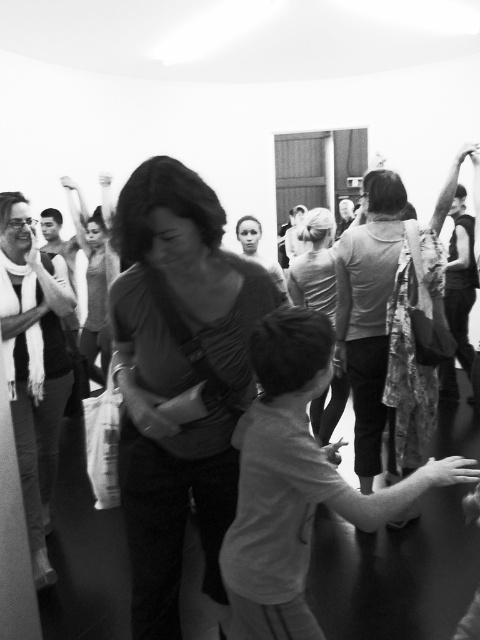
Between white matte shirt at center and smooth gray sweater at center, which one has more height?

white matte shirt at center is taller.

Does white matte shirt at center have a lesser height compared to smooth gray sweater at center?

No, white matte shirt at center is not shorter than smooth gray sweater at center.

The width and height of the screenshot is (480, 640). Find the location of `white matte shirt at center`. white matte shirt at center is located at coordinates 297,481.

This screenshot has height=640, width=480. I want to click on white matte shirt at center, so click(297, 481).

Does matte gray shirt at center have a smaller size compared to matte black shirt at center?

No.

Measure the distance between point [128,324] and camera.

The distance of point [128,324] from camera is 1.50 meters.

The image size is (480, 640). I want to click on matte gray shirt at center, so click(179, 378).

Identify the location of matte gray shirt at center. (179, 378).

Between point (31, 451) and point (332, 387), which one is positioned behind?

The point (332, 387) is behind.

Does matte black shirt at center have a lesser width compared to smooth gray sweater at center?

Indeed, matte black shirt at center has a lesser width compared to smooth gray sweater at center.

Is point (31, 253) closer to viewer compared to point (323, 291)?

Yes, it is.

You are a GUI agent. You are given a task and a screenshot of the screen. Output one action in this format:
    pyautogui.click(x=<x>, y=<y>)
    Task: Click on the matte black shirt at center
    This screenshot has width=480, height=640.
    Given the screenshot: What is the action you would take?
    pyautogui.click(x=34, y=364)